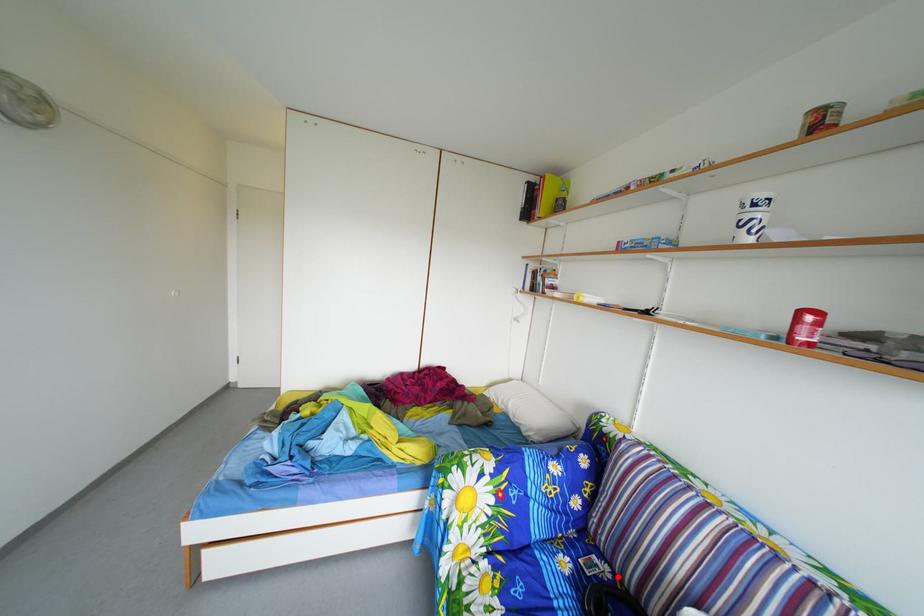
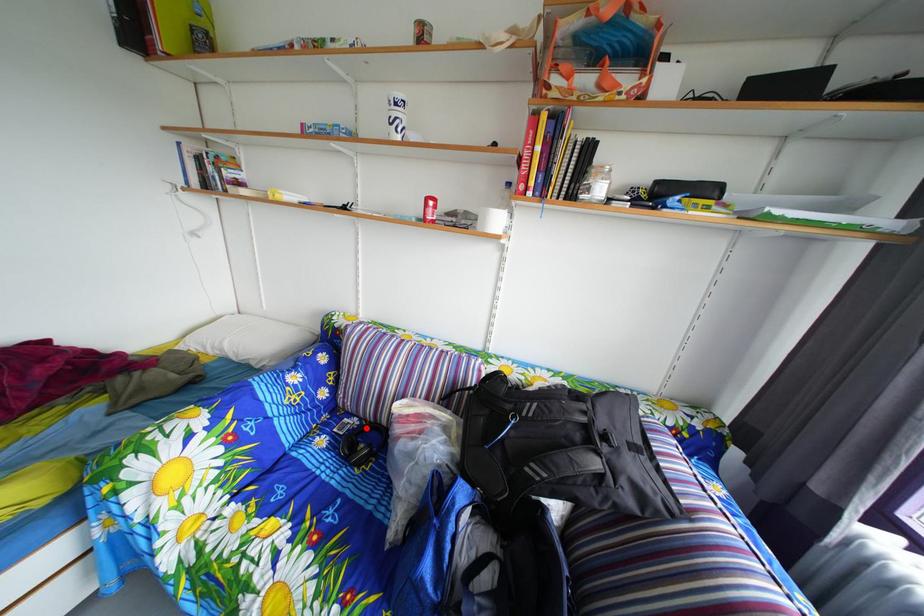
I am providing you with two images of the same scene from different viewpoints. A red point is marked on the first image and another point is marked on the second image. Is the marked point in image1 the same physical position as the marked point in image2?

Yes